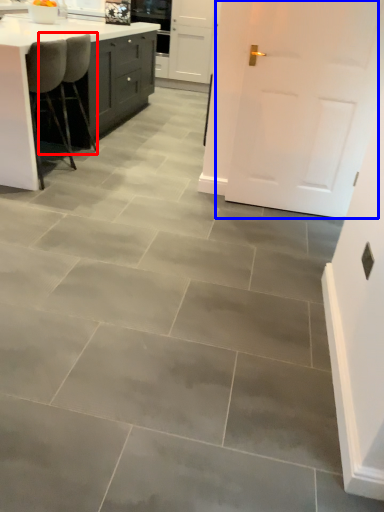
Question: Which object appears closest to the camera in this image, chair (highlighted by a red box) or door (highlighted by a blue box)?

Choices:
 (A) chair
 (B) door

Answer: (B)